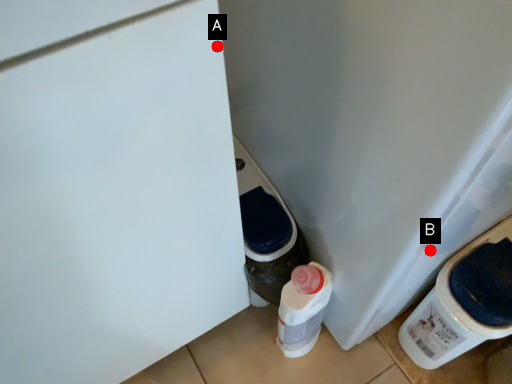
Question: Two points are circled on the image, labeled by A and B beside each circle. Which point is closer to the camera taking this photo?

Choices:
 (A) A is closer
 (B) B is closer

Answer: (A)